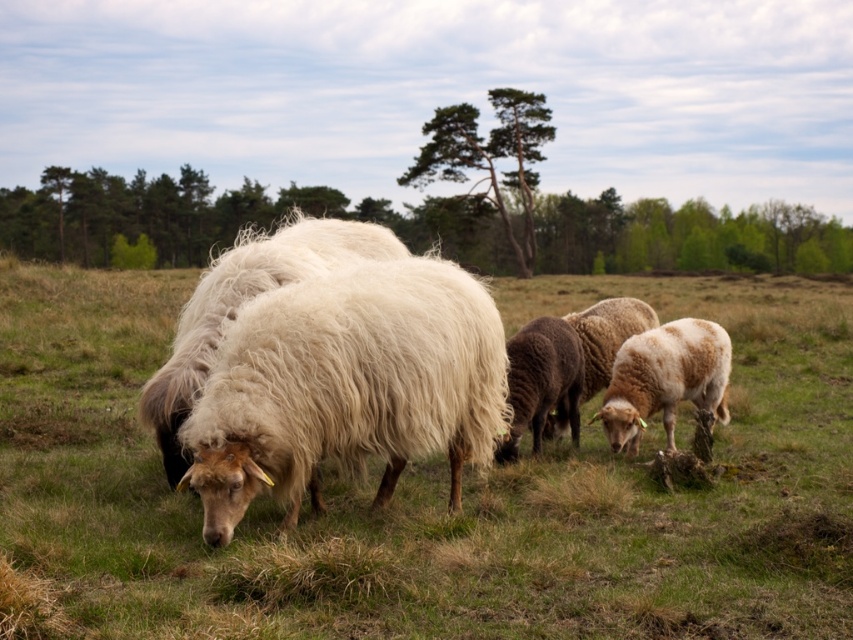
Question: Is the position of white woolly sheep at center more distant than that of dark brown woolly sheep at center?

Choices:
 (A) yes
 (B) no

Answer: (B)

Question: Which point is closer to the camera?

Choices:
 (A) fuzzy white sheep at center
 (B) dark brown woolly sheep at center
 (C) white woolen sheep at center

Answer: (A)

Question: Is fuzzy white sheep at center above dark brown woolly sheep at center?

Choices:
 (A) yes
 (B) no

Answer: (A)

Question: Can you confirm if fuzzy white sheep at center is positioned above white woolly sheep at center?

Choices:
 (A) yes
 (B) no

Answer: (A)

Question: Which point is farther to the camera?

Choices:
 (A) white woolen sheep at center
 (B) light brown woolly sheep at center
 (C) dark brown woolly sheep at center

Answer: (A)

Question: Which point is closer to the camera?

Choices:
 (A) white woolen sheep at center
 (B) dark brown woolly sheep at center

Answer: (B)